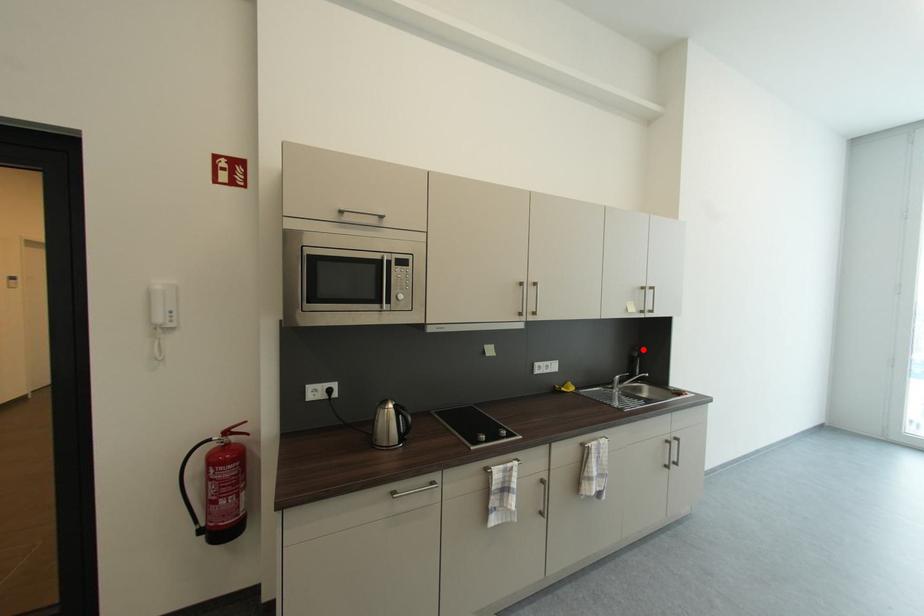
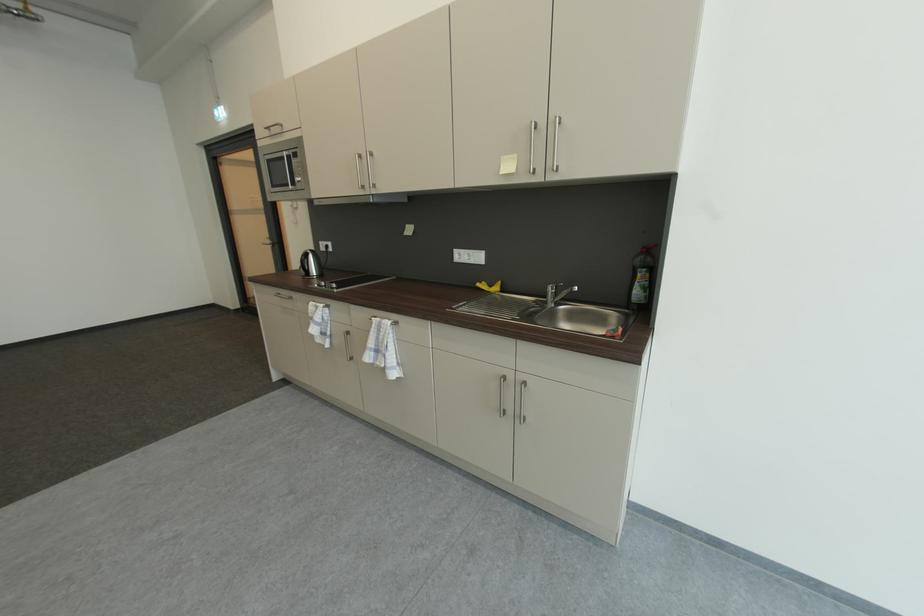
In the second image, find the point that corresponds to the highlighted location in the first image.

(650, 252)